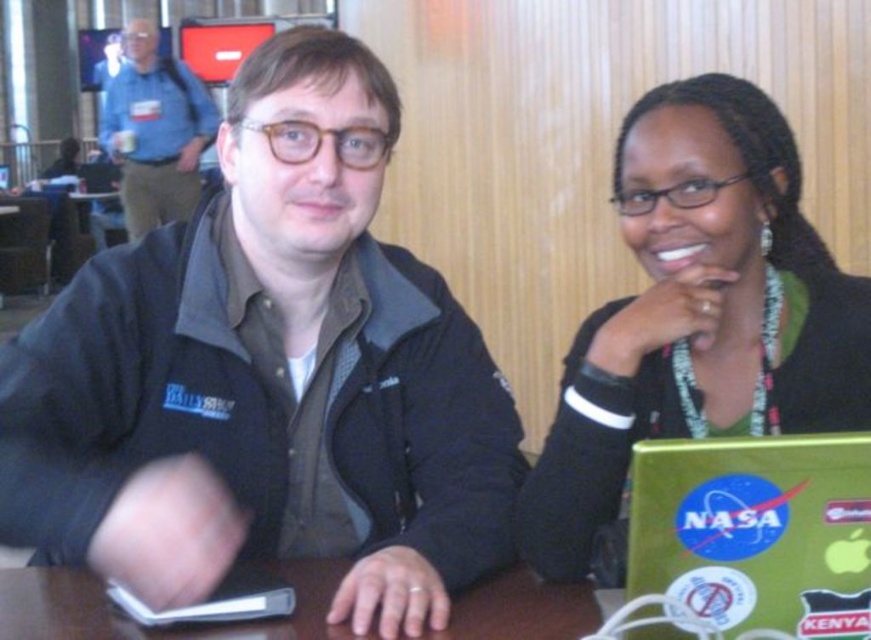
In the scene shown: You are sitting at a table and want to check the battery level on your green matte laptop at lower right. If your arm can reach 30 inches, can you comfortably reach it?

The distance between you and the green matte laptop at lower right is 28.45 inches, which is within your arm reach of 30 inches. Yes, you can comfortably reach it.

You are a photographer setting up for a group photo. You notice the green matte laptop at lower right and the blue fabric jacket at upper left. Which object should you position closer to the camera to ensure both are in focus without adjusting the camera settings?

The green matte laptop at lower right is in front of the blue fabric jacket at upper left. To ensure both are in focus without adjusting the camera settings, position the blue fabric jacket at upper left closer to the camera so that it aligns with the distance of the green matte laptop at lower right.

You are a photographer setting up for a group photo. You need to arrange the black matte jacket at left and the blue fabric jacket at upper left so that they are aligned properly. Which jacket should be moved to the left to achieve this alignment?

The black matte jacket at left is positioned on the right side of the blue fabric jacket at upper left. To align them properly, the black matte jacket at left should be moved to the left so that it is positioned to the left of the blue fabric jacket at upper left.